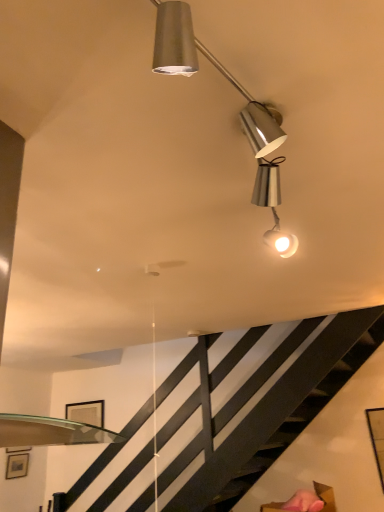
Question: Can you confirm if matte black picture frame at upper center, which is the 2th picture frame from left to right, is smaller than metallic silver lamp at upper center?

Choices:
 (A) yes
 (B) no

Answer: (A)

Question: From the image's perspective, is matte black picture frame at upper center, which appears as the first picture frame when viewed from the back, below metallic silver lamp at upper center?

Choices:
 (A) yes
 (B) no

Answer: (A)

Question: Is metallic silver lamp at upper center at the back of matte black picture frame at upper center, the first picture frame viewed from the top?

Choices:
 (A) no
 (B) yes

Answer: (A)

Question: Can you confirm if matte black picture frame at upper center, the first picture frame positioned from the right, is taller than metallic silver lamp at upper center?

Choices:
 (A) no
 (B) yes

Answer: (B)

Question: Are matte black picture frame at upper center, which appears as the first picture frame when viewed from the back, and metallic silver lamp at upper center making contact?

Choices:
 (A) yes
 (B) no

Answer: (B)

Question: Is metallic silver lamp at upper center to the left or to the right of matte black picture frame at lower left, which is the first picture frame in left-to-right order, in the image?

Choices:
 (A) left
 (B) right

Answer: (B)

Question: Considering the positions of metallic silver lamp at upper center and matte black picture frame at lower left, the 2th picture frame in the back-to-front sequence, in the image, is metallic silver lamp at upper center taller or shorter than matte black picture frame at lower left, the 2th picture frame in the back-to-front sequence,?

Choices:
 (A) short
 (B) tall

Answer: (A)

Question: From a real-world perspective, is metallic silver lamp at upper center above or below matte black picture frame at lower left, arranged as the second picture frame when viewed from the top?

Choices:
 (A) below
 (B) above

Answer: (B)

Question: Is metallic silver lamp at upper center bigger or smaller than matte black picture frame at lower left, the 2th picture frame in the back-to-front sequence?

Choices:
 (A) big
 (B) small

Answer: (A)

Question: Visually, is matte black picture frame at lower left, which is counted as the first picture frame, starting from the front, positioned to the left or to the right of matte black picture frame at upper center, which is counted as the 2th picture frame, starting from the bottom?

Choices:
 (A) right
 (B) left

Answer: (B)

Question: Relative to matte black picture frame at upper center, the first picture frame viewed from the top, is matte black picture frame at lower left, the 2th picture frame in the back-to-front sequence, in front or behind?

Choices:
 (A) front
 (B) behind

Answer: (A)

Question: In terms of size, does matte black picture frame at lower left, acting as the second picture frame starting from the right, appear bigger or smaller than matte black picture frame at upper center, which is counted as the 2th picture frame, starting from the bottom?

Choices:
 (A) big
 (B) small

Answer: (B)

Question: In terms of height, does matte black picture frame at lower left, the first picture frame in the bottom-to-top sequence, look taller or shorter compared to matte black picture frame at upper center, which is counted as the 2th picture frame, starting from the bottom?

Choices:
 (A) tall
 (B) short

Answer: (B)

Question: From the image's perspective, relative to matte black picture frame at lower left, which is counted as the first picture frame, starting from the front, is matte black picture frame at upper center, which appears as the first picture frame when viewed from the back, above or below?

Choices:
 (A) below
 (B) above

Answer: (B)

Question: From their relative heights in the image, would you say matte black picture frame at upper center, which is counted as the 2th picture frame, starting from the bottom, is taller or shorter than matte black picture frame at lower left, the first picture frame in the bottom-to-top sequence?

Choices:
 (A) tall
 (B) short

Answer: (A)